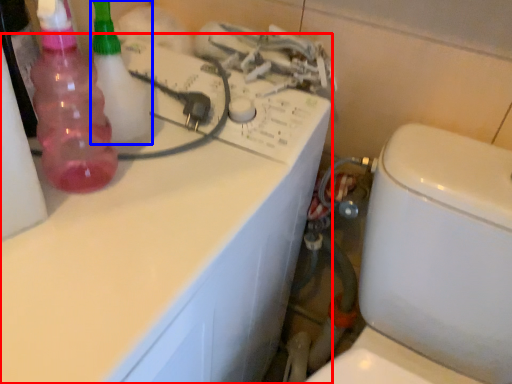
Question: Among these objects, which one is farthest to the camera, counter top (highlighted by a red box) or cleaning product (highlighted by a blue box)?

Choices:
 (A) counter top
 (B) cleaning product

Answer: (B)